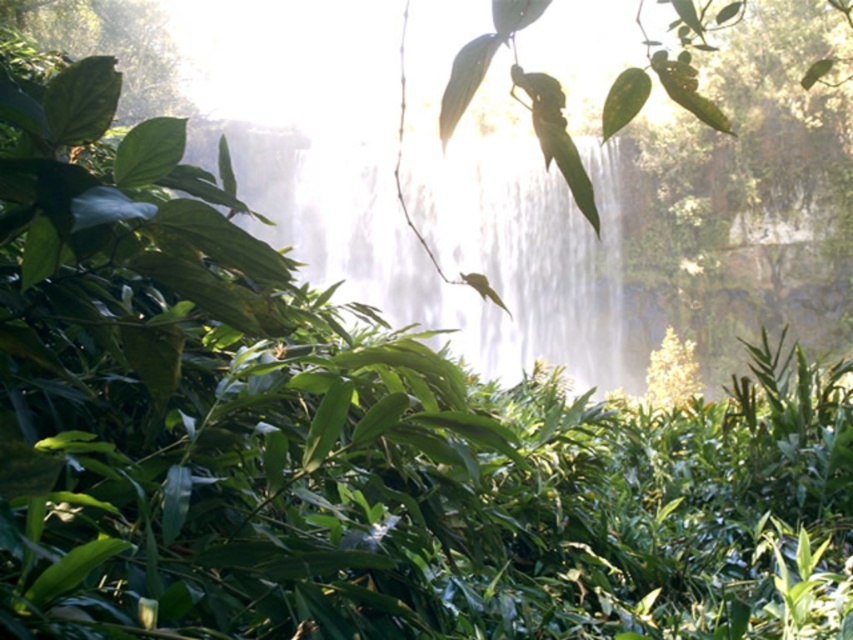
You are standing in a forest clearing and see the white misty waterfall at center and the green leafy plant at upper left. Which object is taller?

The green leafy plant at upper left is taller than the white misty waterfall at center.

You are standing in a lush forest scene with a waterfall in the background. You notice two points marked on the ground. The first point is at coordinates point (329, 179), and the second point is at point (173, 113). Which point is closer to you?

Point (329, 179) is closer to the viewer than point (173, 113).